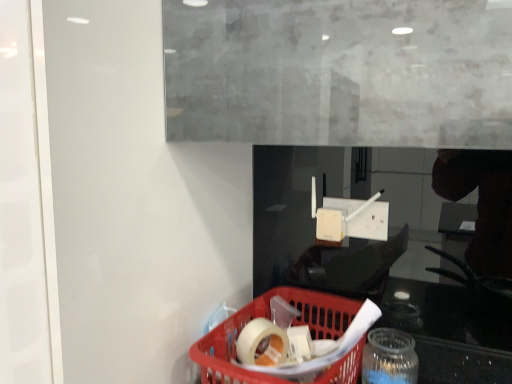
Question: From the image's perspective, is red plastic basket at lower center located above or below translucent plastic basket at lower center?

Choices:
 (A) above
 (B) below

Answer: (A)

Question: Looking at their shapes, would you say red plastic basket at lower center is wider or thinner than translucent plastic basket at lower center?

Choices:
 (A) wide
 (B) thin

Answer: (B)

Question: Which object is positioned closest to the transparent glass jar at lower right?

Choices:
 (A) red plastic basket at lower center
 (B) translucent plastic basket at lower center

Answer: (A)

Question: Considering the real-world distances, which object is farthest from the red plastic basket at lower center?

Choices:
 (A) translucent plastic basket at lower center
 (B) transparent glass jar at lower right

Answer: (B)